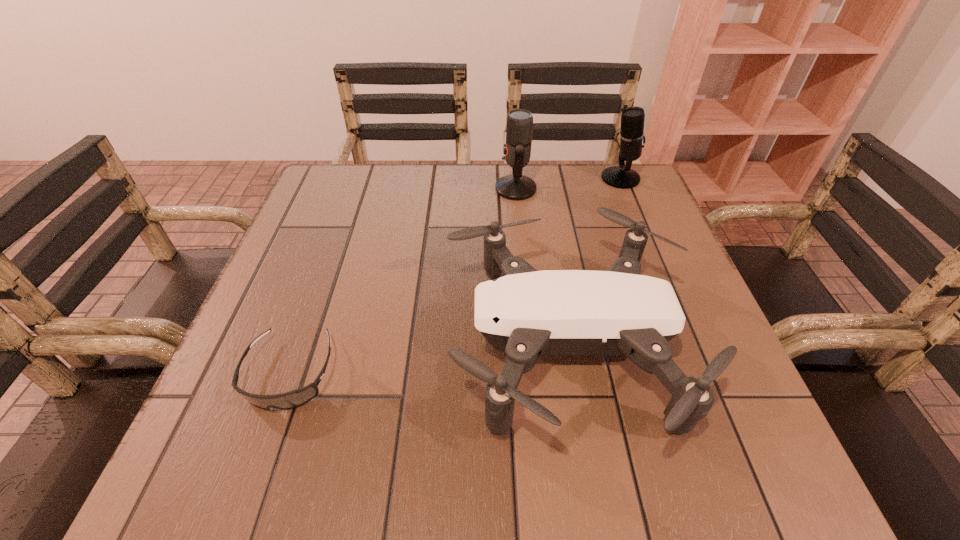
Identify the location of free space located on the camera side of the drone. (313, 344).

Where is `free space located on the camera side of the drone`? Image resolution: width=960 pixels, height=540 pixels. free space located on the camera side of the drone is located at coordinates (379, 344).

Locate an element on the screen. Image resolution: width=960 pixels, height=540 pixels. free location located 0.100m on the lenses of the goggles is located at coordinates (252, 481).

The height and width of the screenshot is (540, 960). In order to click on object that is at the near edge in this screenshot , I will do `click(526, 313)`.

Image resolution: width=960 pixels, height=540 pixels. I want to click on object that is at the left edge, so click(295, 398).

Where is `microphone situated at the right edge`? Image resolution: width=960 pixels, height=540 pixels. microphone situated at the right edge is located at coordinates (632, 137).

Where is `drone located in the right edge section of the desktop`? The width and height of the screenshot is (960, 540). drone located in the right edge section of the desktop is located at coordinates (526, 313).

What are the coordinates of `object at the far right corner` in the screenshot? It's located at point(632,137).

Where is `object that is at the near right corner`? The width and height of the screenshot is (960, 540). object that is at the near right corner is located at coordinates 526,313.

You are a GUI agent. You are given a task and a screenshot of the screen. Output one action in this format:
    pyautogui.click(x=<x>, y=<y>)
    Task: Click on the free point at the far edge
    
    Given the screenshot: What is the action you would take?
    pyautogui.click(x=442, y=172)